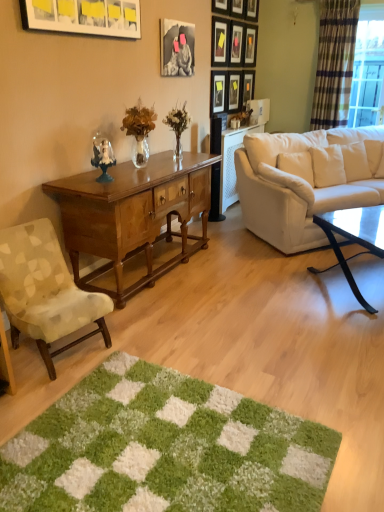
At what (x,y) coordinates should I click in order to perform the action: click on vacant space in between light brown wood desk at center and white fabric couch at right. Please return your answer as a coordinate pair (x, y). This screenshot has height=512, width=384. Looking at the image, I should click on (235, 263).